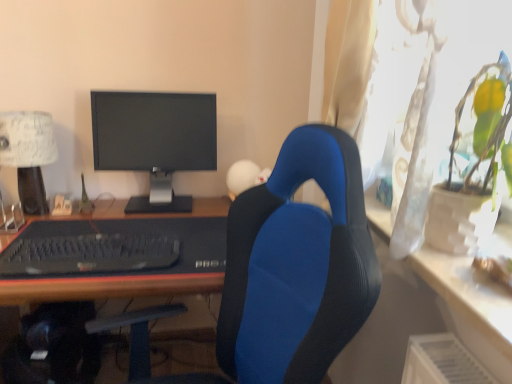
Question: Does matte black monitor at center have a larger size compared to black matte keyboard at lower left?

Choices:
 (A) no
 (B) yes

Answer: (B)

Question: From a real-world perspective, is matte black monitor at center physically below black matte keyboard at lower left?

Choices:
 (A) yes
 (B) no

Answer: (B)

Question: Is black matte keyboard at lower left at the back of matte black monitor at center?

Choices:
 (A) no
 (B) yes

Answer: (A)

Question: Does matte black monitor at center have a lesser width compared to black matte keyboard at lower left?

Choices:
 (A) no
 (B) yes

Answer: (B)

Question: From the image's perspective, does matte black monitor at center appear lower than black matte keyboard at lower left?

Choices:
 (A) no
 (B) yes

Answer: (A)

Question: Is matte black monitor at center next to black matte keyboard at lower left?

Choices:
 (A) no
 (B) yes

Answer: (A)

Question: Is black rubberized desk at center facing towards black matte keyboard at lower left?

Choices:
 (A) yes
 (B) no

Answer: (B)

Question: Does black rubberized desk at center lie behind black matte keyboard at lower left?

Choices:
 (A) no
 (B) yes

Answer: (A)

Question: Is black matte keyboard at lower left completely or partially inside black rubberized desk at center?

Choices:
 (A) yes
 (B) no

Answer: (B)

Question: Can you confirm if black rubberized desk at center is wider than black matte keyboard at lower left?

Choices:
 (A) yes
 (B) no

Answer: (A)

Question: Does black rubberized desk at center have a smaller size compared to black matte keyboard at lower left?

Choices:
 (A) no
 (B) yes

Answer: (A)

Question: Is black rubberized desk at center closer to camera compared to black matte keyboard at lower left?

Choices:
 (A) no
 (B) yes

Answer: (B)

Question: Is black rubberized desk at center closer to the viewer compared to blue fabric chair at center?

Choices:
 (A) no
 (B) yes

Answer: (A)